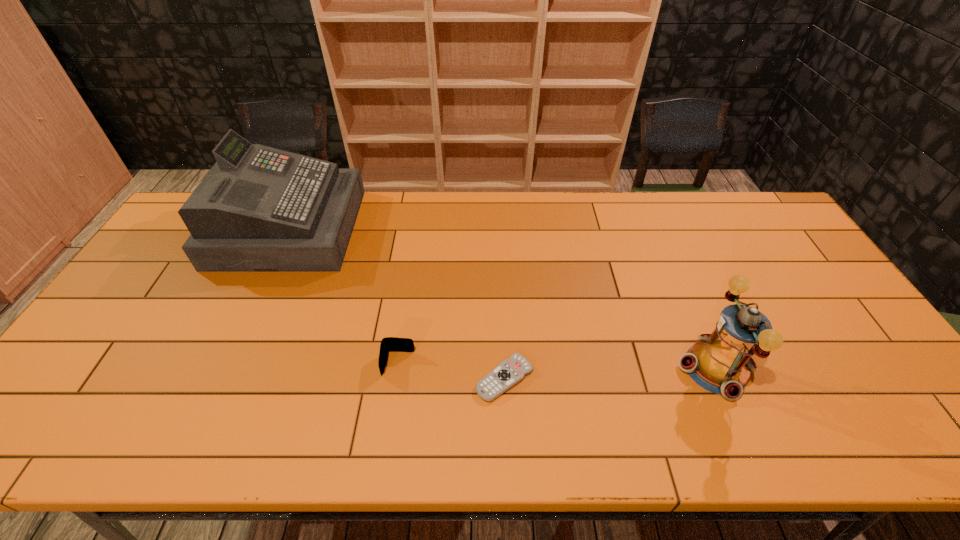
This screenshot has height=540, width=960. In the image, there is a desktop. What are the coordinates of `free space at the far left corner` in the screenshot? It's located at (180, 232).

I want to click on free point between the remote control and the rightmost object, so click(610, 373).

You are a GUI agent. You are given a task and a screenshot of the screen. Output one action in this format:
    pyautogui.click(x=<x>, y=<y>)
    Task: Click on the free space that is in between the remote control and the leftmost object
    The image size is (960, 540).
    Given the screenshot: What is the action you would take?
    pyautogui.click(x=396, y=303)

Where is `vacant region between the remote control and the farthest object`? The image size is (960, 540). vacant region between the remote control and the farthest object is located at coordinates (396, 303).

The height and width of the screenshot is (540, 960). Identify the location of unoccupied position between the lantern and the second shortest object. (557, 366).

Identify the location of free space between the second object from right to left and the second object from left to right. This screenshot has height=540, width=960. (451, 371).

Locate an element on the screen. free space between the cash register and the third tallest object is located at coordinates (344, 296).

Where is `blank region between the farthest object and the second object from left to right`? The width and height of the screenshot is (960, 540). blank region between the farthest object and the second object from left to right is located at coordinates 344,296.

Find the location of a particular element. Image resolution: width=960 pixels, height=540 pixels. free spot between the farthest object and the rightmost object is located at coordinates click(x=502, y=298).

Locate an element on the screen. Image resolution: width=960 pixels, height=540 pixels. unoccupied area between the second shortest object and the rightmost object is located at coordinates (557, 366).